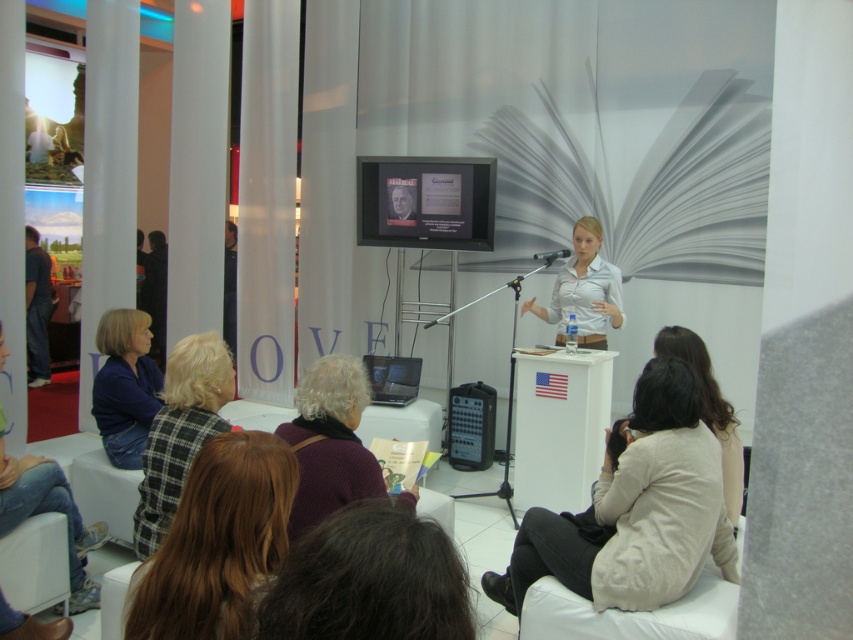
Question: Which object appears farthest from the camera in this image?

Choices:
 (A) plaid fabric jacket at lower left
 (B) light beige sweater at lower right

Answer: (B)

Question: From the image, what is the correct spatial relationship of blonde hair at lower center in relation to dark purple sweater at lower center?

Choices:
 (A) above
 (B) below

Answer: (B)

Question: Which of these objects is positioned closest to the dark purple sweater at lower center?

Choices:
 (A) light beige sweater at lower right
 (B) dark fabric jacket at left

Answer: (A)

Question: Can you confirm if blonde hair at lower center is positioned to the right of plaid fabric jacket at lower left?

Choices:
 (A) yes
 (B) no

Answer: (A)

Question: Among these objects, which one is nearest to the camera?

Choices:
 (A) white shirt at center
 (B) dark fabric jacket at left
 (C) plaid fabric jacket at lower left

Answer: (C)

Question: Is plaid fabric jacket at lower left positioned before dark blue jeans at left?

Choices:
 (A) yes
 (B) no

Answer: (A)